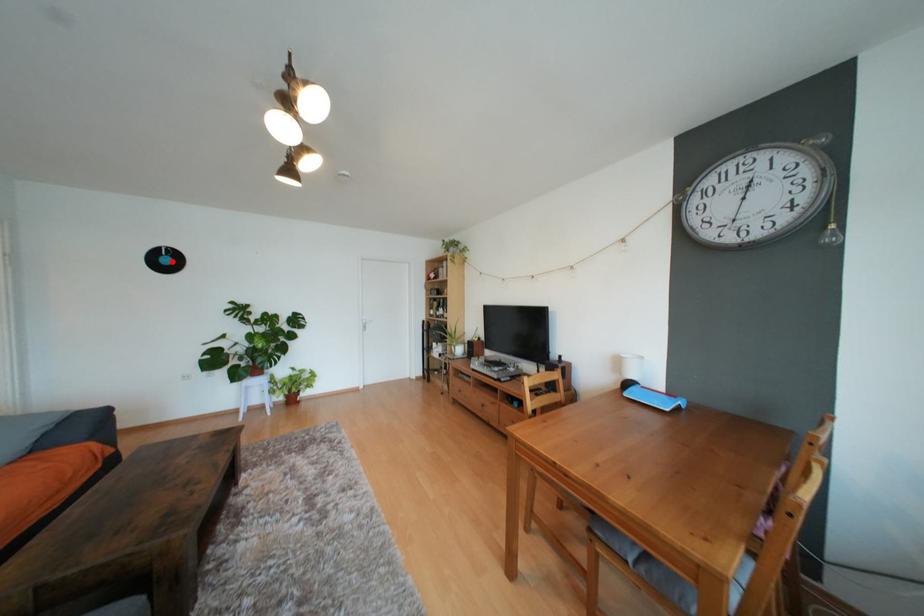
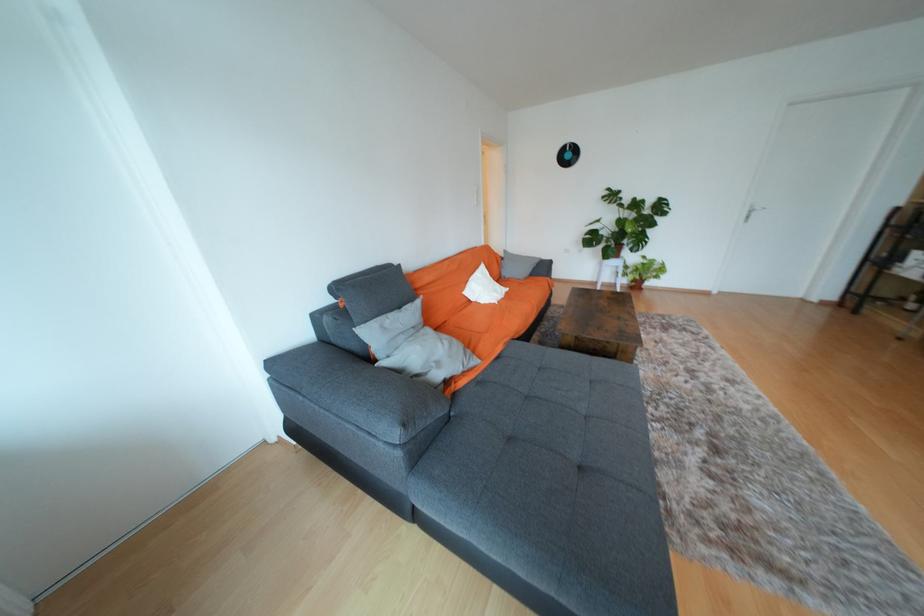
In the second image, find the point that corresponds to the highlighted location in the first image.

(574, 156)